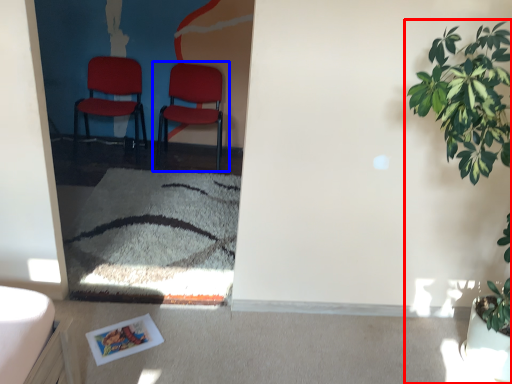
Question: Which point is further to the camera, houseplant (highlighted by a red box) or chair (highlighted by a blue box)?

Choices:
 (A) houseplant
 (B) chair

Answer: (B)